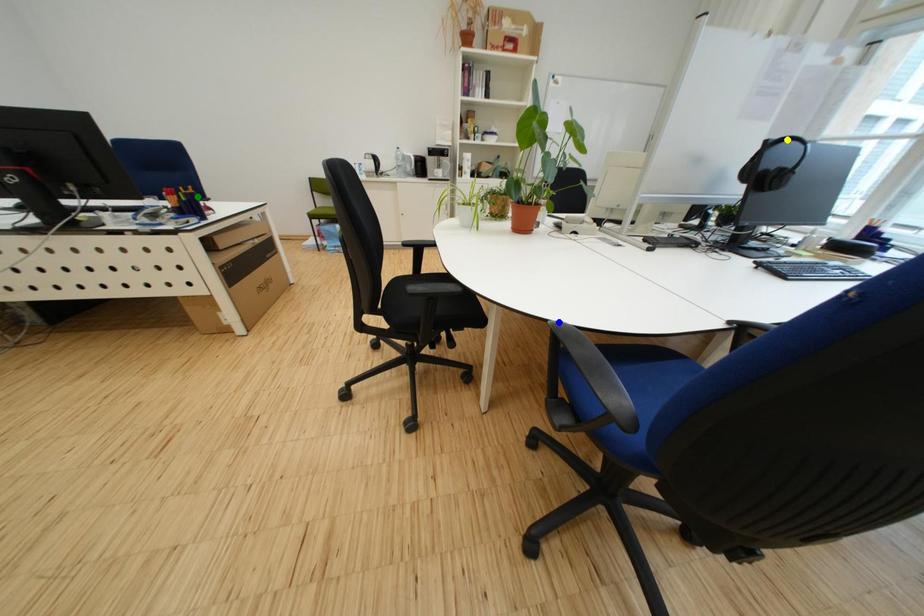
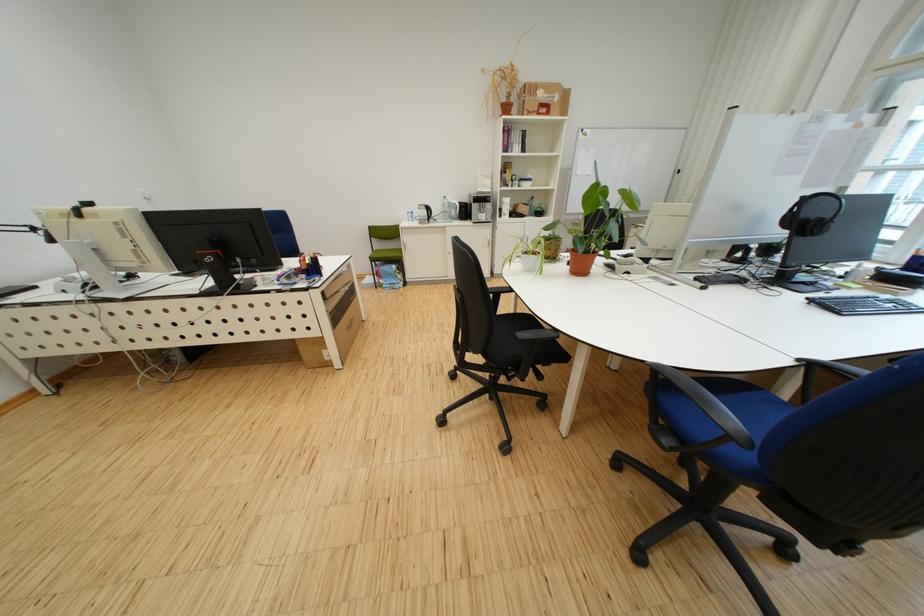
I am providing you with two images of the same scene from different viewpoints. Three points are marked in image1. Which point corresponds to a part or object that is occluded in image2?In image1, three points are marked. Which of them correspond to a part or object that is occluded in image2?Among the three points shown in image1, which one corresponds to a part or object that is no longer visible due to occlusion in image2?

Invisible in image2: green point.